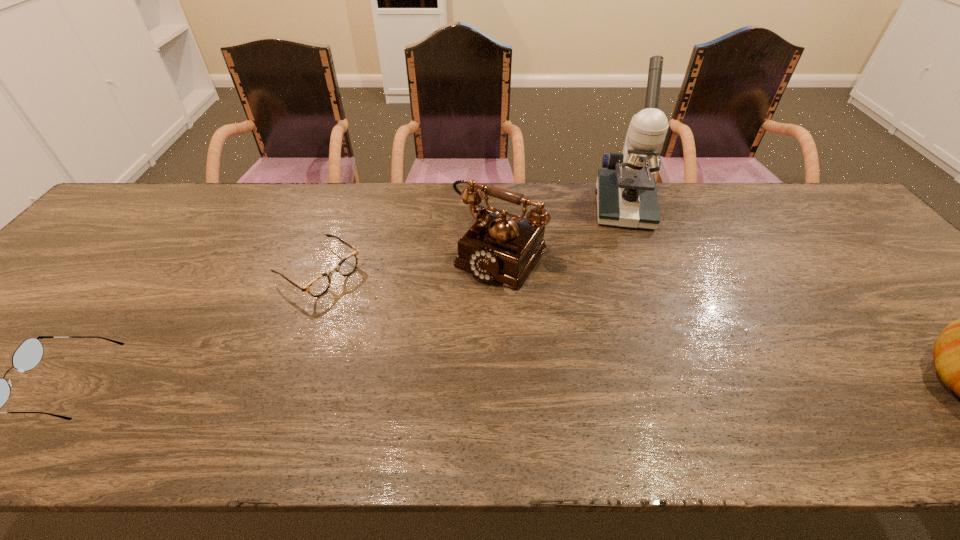
Identify the location of the fourth object from right to left. click(321, 284).

This screenshot has height=540, width=960. I want to click on the right spectacles, so click(x=321, y=284).

In order to click on the fourth shortest object in this screenshot , I will do `click(500, 246)`.

Where is `telephone`? telephone is located at coordinates (500, 246).

The height and width of the screenshot is (540, 960). What are the coordinates of `the fourth object from left to right` in the screenshot? It's located at (626, 192).

Locate an element on the screen. The image size is (960, 540). the tallest object is located at coordinates (626, 192).

I want to click on free space located on the frame of the right spectacles, so click(x=398, y=324).

Find the location of `vacant space located 0.340m on the frame of the right spectacles`. vacant space located 0.340m on the frame of the right spectacles is located at coordinates coord(451,358).

Locate an element on the screen. free space located on the frame of the right spectacles is located at coordinates (420, 338).

Image resolution: width=960 pixels, height=540 pixels. What are the coordinates of `vacant space situated 0.090m on the dial of the fourth shortest object` in the screenshot? It's located at (460, 308).